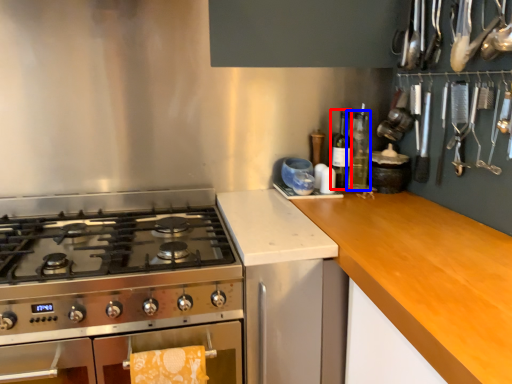
Question: Which point is further to the camera, bottle (highlighted by a red box) or bottle (highlighted by a blue box)?

Choices:
 (A) bottle
 (B) bottle

Answer: (B)